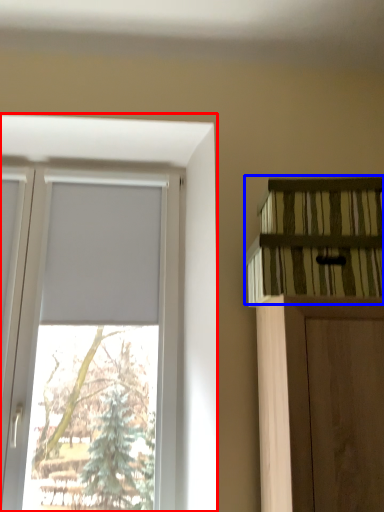
Question: Which point is closer to the camera, window (highlighted by a red box) or shelf (highlighted by a blue box)?

Choices:
 (A) window
 (B) shelf

Answer: (B)